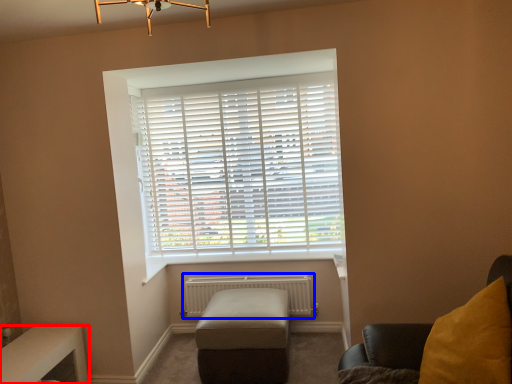
Question: Which object is closer to the camera taking this photo, table (highlighted by a red box) or radiator (highlighted by a blue box)?

Choices:
 (A) table
 (B) radiator

Answer: (A)